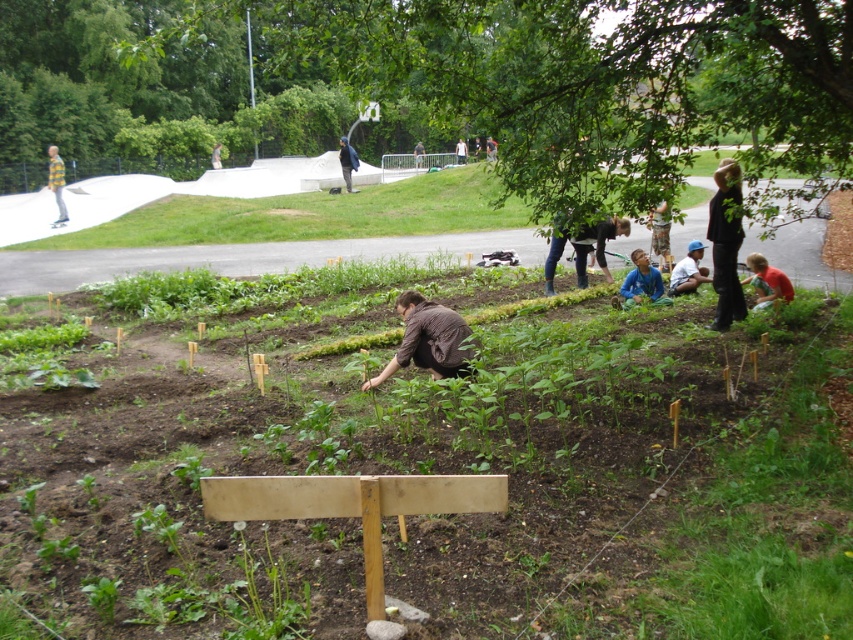
From the picture: Who is shorter, blue shirt at center or light brown wooden signpost at center?

blue shirt at center

Can you confirm if blue shirt at center is smaller than light brown wooden signpost at center?

Indeed, blue shirt at center has a smaller size compared to light brown wooden signpost at center.

What do you see at coordinates (642, 282) in the screenshot?
I see `blue shirt at center` at bounding box center [642, 282].

Image resolution: width=853 pixels, height=640 pixels. I want to click on blue shirt at center, so click(642, 282).

In the scene shown: Does wooden figure at center have a smaller size compared to light brown shirt at center?

Correct, wooden figure at center occupies less space than light brown shirt at center.

Which is below, wooden figure at center or light brown shirt at center?

wooden figure at center

Is point (660, 214) farther from viewer compared to point (457, 144)?

No, (660, 214) is closer to viewer.

Find the location of a particular element. wooden figure at center is located at coordinates (660, 234).

Who is lower down, blue fabric shirt at center or yellow striped shirt at left?

Positioned lower is blue fabric shirt at center.

Is blue fabric shirt at center taller than yellow striped shirt at left?

No, blue fabric shirt at center is not taller than yellow striped shirt at left.

The image size is (853, 640). Find the location of `blue fabric shirt at center`. blue fabric shirt at center is located at coordinates (688, 272).

Identify the location of blue fabric shirt at center. The width and height of the screenshot is (853, 640). (688, 272).